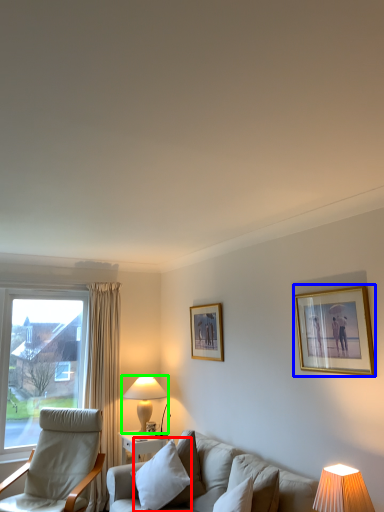
Question: Based on their relative distances, which object is nearer to pillow (highlighted by a red box)? Choose from picture frame (highlighted by a blue box) and table lamp (highlighted by a green box).

Choices:
 (A) picture frame
 (B) table lamp

Answer: (B)